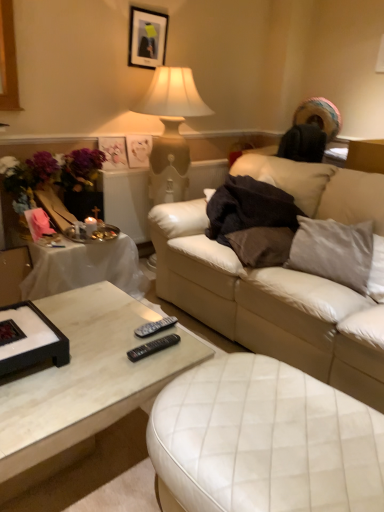
Identify the location of vacant space in front of black plastic remote at center, which is the 2th remote from front to back. (137, 364).